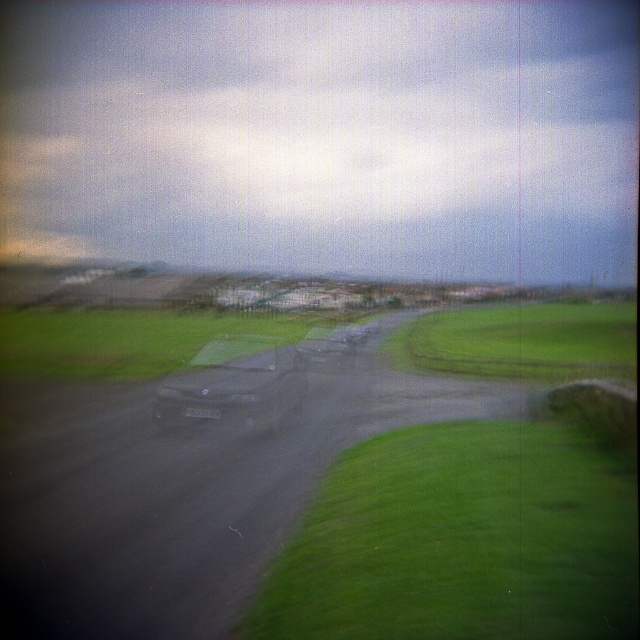
You are standing at the point marked by point (477, 433) and want to walk towards the point marked by point (173, 356). Based on the scene description, which direction should you head?

You should head towards the lower right direction since point (173, 356) is located in the lower right area of the image compared to point (477, 433).

You are a driver approaching the shiny metallic car at center on the green grassy field at center. To avoid collision, should you steer to the right or left?

The green grassy field at center is to the left of the shiny metallic car at center, so to avoid collision, you should steer to the right.